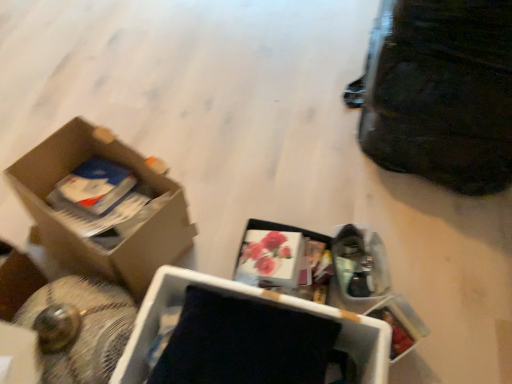
Question: Considering the relative sizes of cardboard box at left, acting as the 2th box starting from the right, and black matte box at center, which is the second box from left to right, in the image provided, is cardboard box at left, acting as the 2th box starting from the right, thinner than black matte box at center, which is the second box from left to right,?

Choices:
 (A) no
 (B) yes

Answer: (A)

Question: Is cardboard box at left, placed as the first box when sorted from left to right, far from black matte box at center, acting as the first box starting from the right?

Choices:
 (A) no
 (B) yes

Answer: (A)

Question: Is cardboard box at left, placed as the first box when sorted from left to right, bigger than black matte box at center, which is the second box from left to right?

Choices:
 (A) no
 (B) yes

Answer: (B)

Question: Does cardboard box at left, acting as the 2th box starting from the right, have a greater width compared to black matte box at center, which is the second box from left to right?

Choices:
 (A) no
 (B) yes

Answer: (B)

Question: Is cardboard box at left, placed as the first box when sorted from left to right, positioned before black matte box at center, which is the second box from left to right?

Choices:
 (A) yes
 (B) no

Answer: (B)

Question: Would you say black matte box at center, which is the second box from left to right, is part of cardboard box at left, placed as the first box when sorted from left to right,'s contents?

Choices:
 (A) no
 (B) yes

Answer: (A)

Question: Is black leather bag at upper right smaller than black matte box at center, which is the second box from left to right?

Choices:
 (A) no
 (B) yes

Answer: (A)

Question: Is black leather bag at upper right behind black matte box at center, which is the second box from left to right?

Choices:
 (A) no
 (B) yes

Answer: (B)

Question: Is black leather bag at upper right next to black matte box at center, acting as the first box starting from the right?

Choices:
 (A) yes
 (B) no

Answer: (B)

Question: Is black leather bag at upper right taller than black matte box at center, acting as the first box starting from the right?

Choices:
 (A) yes
 (B) no

Answer: (A)

Question: From the image's perspective, is black leather bag at upper right over black matte box at center, which is the second box from left to right?

Choices:
 (A) yes
 (B) no

Answer: (A)

Question: Does black leather bag at upper right turn towards black matte box at center, acting as the first box starting from the right?

Choices:
 (A) no
 (B) yes

Answer: (A)

Question: Is cardboard box at left, acting as the 2th box starting from the right, next to black leather bag at upper right and touching it?

Choices:
 (A) no
 (B) yes

Answer: (A)